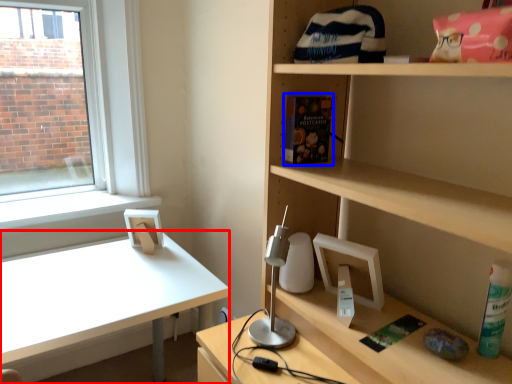
Question: Which object appears farthest to the camera in this image, desk (highlighted by a red box) or book (highlighted by a blue box)?

Choices:
 (A) desk
 (B) book

Answer: (A)